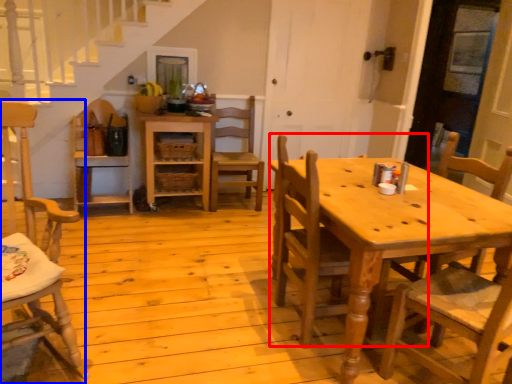
Question: Which point is further to the camera, chair (highlighted by a red box) or chair (highlighted by a blue box)?

Choices:
 (A) chair
 (B) chair

Answer: (A)